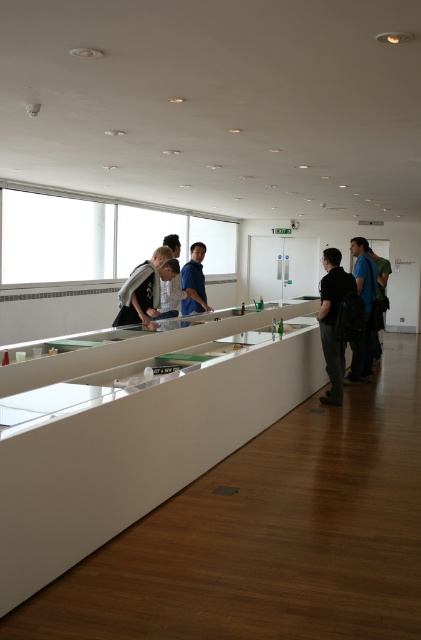
You are an organizer preparing to arrange items in the display case. You have a blue shirt at center and a blue fabric backpack at center. Which item should you place on the lower shelf if you want to place the smaller item there?

The blue shirt at center is smaller than the blue fabric backpack at center, so you should place the blue shirt at center on the lower shelf.

In the scene shown: You are standing in the exhibition space and see two points marked in the display case. Which point, point [197,244] or point [386,269], is closer to you?

Point [197,244] is closer to the viewer than point [386,269].

You are standing in the exhibition space and see both the blue shirt at center and the blue fabric backpack at center. Which object is nearer to you?

The blue shirt at center is closer to the viewer than the blue fabric backpack at center.